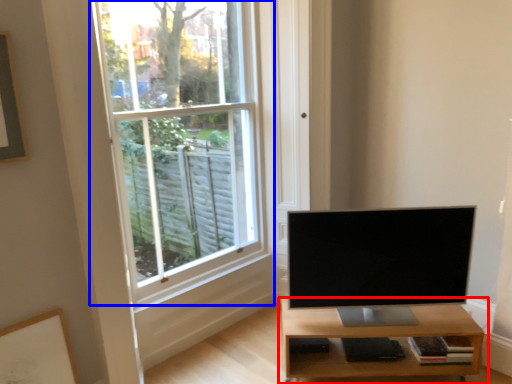
Question: Which point is closer to the camera, shelf (highlighted by a red box) or window (highlighted by a blue box)?

Choices:
 (A) shelf
 (B) window

Answer: (B)